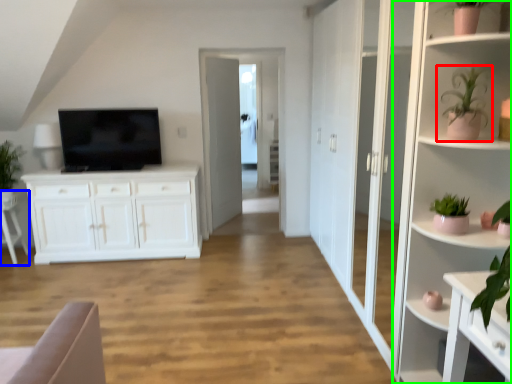
Question: Which object is the closest to the houseplant (highlighted by a red box)? Choose among these: armchair (highlighted by a blue box) or shelf (highlighted by a green box).

Choices:
 (A) armchair
 (B) shelf

Answer: (B)